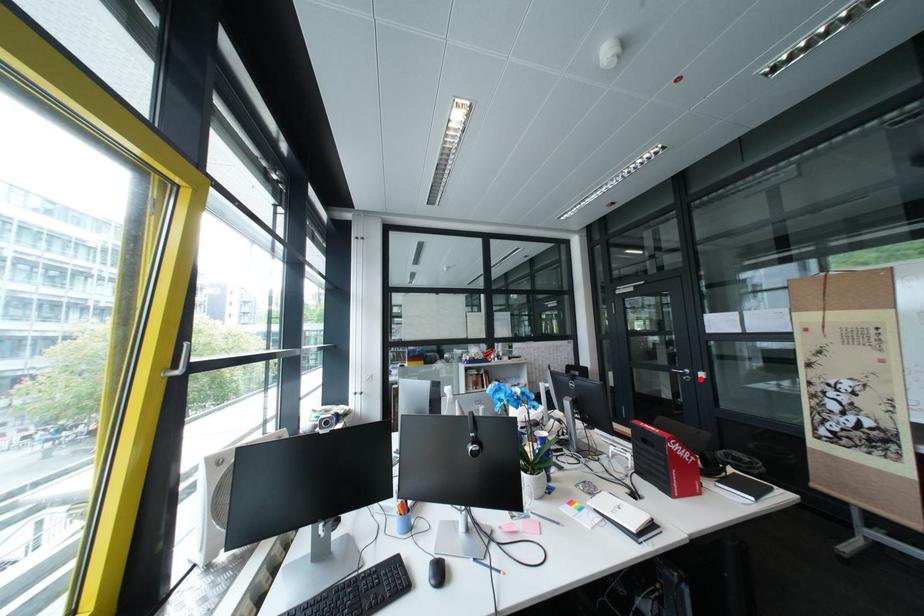
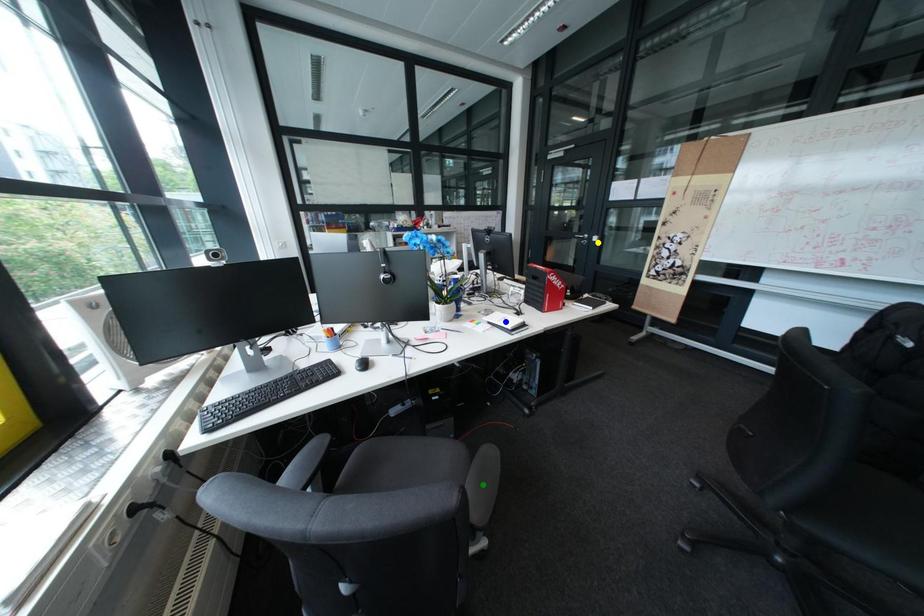
Question: I am providing you with two images of the same scene from different viewpoints. A red point is marked on the first image. You are given multiple points on the second image. Which point in image 2 represents the same 3d spot as the red point in image 1?

Choices:
 (A) yellow point
 (B) green point
 (C) blue point

Answer: (A)